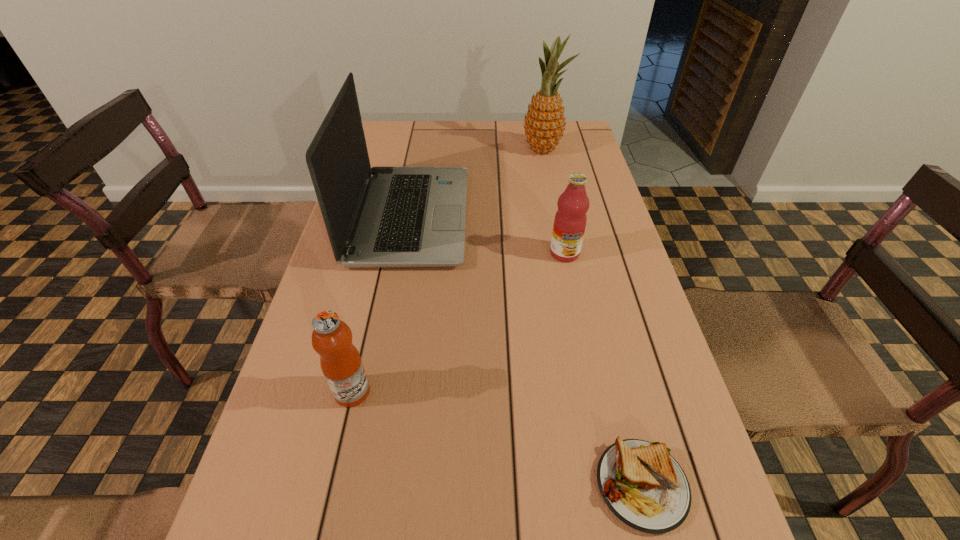
In order to click on free spot between the sandwich and the farthest object in this screenshot , I will do `click(592, 318)`.

This screenshot has height=540, width=960. Identify the location of empty space that is in between the farther fruit juice and the second tallest object. (488, 235).

This screenshot has height=540, width=960. Find the location of `vacant area that lies between the nearer fruit juice and the pineapple`. vacant area that lies between the nearer fruit juice and the pineapple is located at coordinates (447, 271).

You are a GUI agent. You are given a task and a screenshot of the screen. Output one action in this format:
    pyautogui.click(x=<x>, y=<y>)
    Task: Click on the free space between the farther fruit juice and the sandwich
    This screenshot has height=540, width=960.
    Given the screenshot: What is the action you would take?
    pyautogui.click(x=603, y=369)

You are a GUI agent. You are given a task and a screenshot of the screen. Output one action in this format:
    pyautogui.click(x=<x>, y=<y>)
    Task: Click on the object that ranks as the second closest to the left fruit juice
    This screenshot has width=960, height=540.
    Given the screenshot: What is the action you would take?
    pyautogui.click(x=642, y=484)

The width and height of the screenshot is (960, 540). I want to click on object that is the third closest one to the shortest object, so click(381, 216).

The width and height of the screenshot is (960, 540). What are the coordinates of `vacant area in the image that satisfies the following two spatial constraints: 1. on the label of the shortest object; 2. on the right side of the farther fruit juice` in the screenshot? It's located at (612, 485).

Where is `vacant space that satisfies the following two spatial constraints: 1. on the label of the nearest object; 2. on the right side of the farther fruit juice`? The image size is (960, 540). vacant space that satisfies the following two spatial constraints: 1. on the label of the nearest object; 2. on the right side of the farther fruit juice is located at coordinates (612, 485).

The width and height of the screenshot is (960, 540). I want to click on free spot that satisfies the following two spatial constraints: 1. on the front side of the sandwich; 2. on the right side of the pineapple, so click(611, 485).

Find the location of `vacant space that satisfies the following two spatial constraints: 1. on the label of the right fruit juice; 2. on the front label of the nearer fruit juice`. vacant space that satisfies the following two spatial constraints: 1. on the label of the right fruit juice; 2. on the front label of the nearer fruit juice is located at coordinates (592, 392).